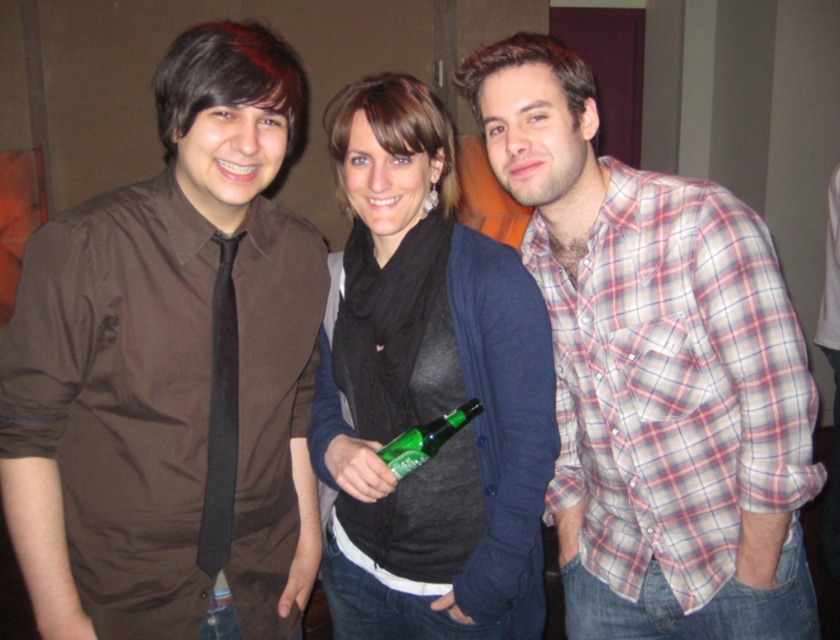
Question: Is plaid cotton shirt at center above green glass bottle at center?

Choices:
 (A) yes
 (B) no

Answer: (A)

Question: Which of the following is the closest to the observer?

Choices:
 (A) green glass bottle at center
 (B) matte black scarf at center

Answer: (B)

Question: Based on their relative distances, which object is nearer to the matte brown shirt at left?

Choices:
 (A) green glass bottle at center
 (B) matte black scarf at center
 (C) plaid cotton shirt at center

Answer: (B)

Question: Which is nearer to the matte black scarf at center?

Choices:
 (A) green glass bottle at center
 (B) plaid cotton shirt at center
 (C) matte brown shirt at left

Answer: (B)

Question: Is matte brown shirt at left wider than matte black scarf at center?

Choices:
 (A) no
 (B) yes

Answer: (B)

Question: Does plaid cotton shirt at center lie in front of matte black scarf at center?

Choices:
 (A) yes
 (B) no

Answer: (A)